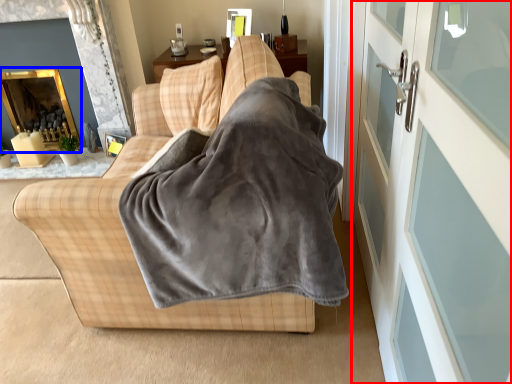
Question: Which of the following is the closest to the observer, screen door (highlighted by a red box) or fireplace (highlighted by a blue box)?

Choices:
 (A) screen door
 (B) fireplace

Answer: (A)